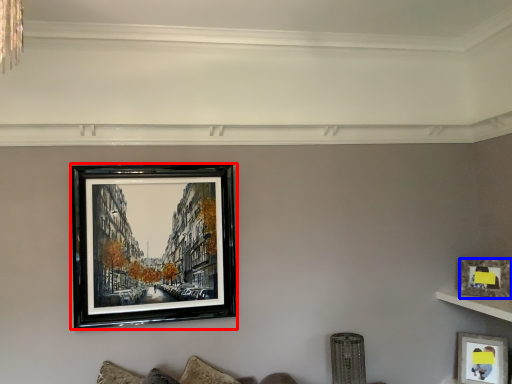
Question: Among these objects, which one is nearest to the camera, picture frame (highlighted by a red box) or picture frame (highlighted by a blue box)?

Choices:
 (A) picture frame
 (B) picture frame

Answer: (A)